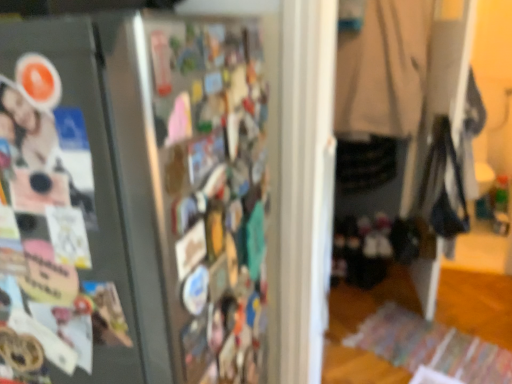
Describe the element at coordinates (45, 154) in the screenshot. I see `matte photo at left` at that location.

In order to face satin black fridge at left, should I rotate leftwards or rightwards?

You should look left and rotate roughly 15.573 degrees.

Measure the distance between satin black fridge at left and camera.

A distance of 17.91 inches exists between satin black fridge at left and camera.

Image resolution: width=512 pixels, height=384 pixels. Identify the location of matte photo at left. (45, 154).

Considering the sizes of satin black fridge at left and matte photo at left in the image, is satin black fridge at left bigger or smaller than matte photo at left?

Clearly, satin black fridge at left is larger in size than matte photo at left.

The image size is (512, 384). Identify the location of person to the left of satin black fridge at left. (45, 154).

Could you tell me if satin black fridge at left is turned towards matte photo at left?

No, satin black fridge at left is not aimed at matte photo at left.

From the image's perspective, does satin black fridge at left appear higher than matte photo at left?

Incorrect, from the image's perspective, satin black fridge at left is lower than matte photo at left.

From a real-world perspective, is satin black fridge at left physically located above or below beige fabric coat at center?

satin black fridge at left is below beige fabric coat at center.

Between satin black fridge at left and beige fabric coat at center, which one appears on the left side from the viewer's perspective?

satin black fridge at left is more to the left.

From the image's perspective, would you say satin black fridge at left is shown under beige fabric coat at center?

Yes, from the image's perspective, satin black fridge at left is below beige fabric coat at center.

Is satin black fridge at left shorter than beige fabric coat at center?

No.

Does beige fabric coat at center appear on the right side of satin black fridge at left?

Yes.

From a real-world perspective, is beige fabric coat at center under satin black fridge at left?

No, from a real-world perspective, beige fabric coat at center is not under satin black fridge at left.

What's the angular difference between beige fabric coat at center and satin black fridge at left's facing directions?

The angle between the facing direction of beige fabric coat at center and the facing direction of satin black fridge at left is 90.8 degrees.

Can you confirm if beige fabric coat at center is bigger than satin black fridge at left?

Incorrect, beige fabric coat at center is not larger than satin black fridge at left.

Measure the distance from beige fabric coat at center to matte photo at left.

beige fabric coat at center and matte photo at left are 7.00 feet apart from each other.

Who is taller, beige fabric coat at center or matte photo at left?

beige fabric coat at center is taller.

Does beige fabric coat at center touch matte photo at left?

beige fabric coat at center and matte photo at left are clearly separated.

In terms of width, does beige fabric coat at center look wider or thinner when compared to matte photo at left?

beige fabric coat at center is wider than matte photo at left.

Is matte photo at left oriented away from satin black fridge at left?

Yes.

Is point (16, 186) more distant than point (81, 51)?

Yes, it is.

Which object is more forward, matte photo at left or satin black fridge at left?

satin black fridge at left is more forward.

From a real-world perspective, which object rests below the other?

beige fabric coat at center, from a real-world perspective.

Considering the sizes of matte photo at left and beige fabric coat at center in the image, is matte photo at left taller or shorter than beige fabric coat at center?

Clearly, matte photo at left is shorter compared to beige fabric coat at center.

Is matte photo at left in front of or behind beige fabric coat at center in the image?

Clearly, matte photo at left is in front of beige fabric coat at center.

Locate an element on the screen. Image resolution: width=512 pixels, height=384 pixels. refrigerator in front of the matte photo at left is located at coordinates (166, 195).

You are a GUI agent. You are given a task and a screenshot of the screen. Output one action in this format:
    pyautogui.click(x=<x>, y=<y>)
    Task: Click on the clothing behind the satin black fridge at left
    
    Given the screenshot: What is the action you would take?
    pyautogui.click(x=384, y=69)

Based on their spatial positions, is matte photo at left or beige fabric coat at center closer to satin black fridge at left?

matte photo at left.

Considering their positions, is satin black fridge at left positioned further to matte photo at left than beige fabric coat at center?

beige fabric coat at center is positioned further to the anchor matte photo at left.

Looking at the image, which one is located closer to matte photo at left, beige fabric coat at center or satin black fridge at left?

The object closer to matte photo at left is satin black fridge at left.

Based on their spatial positions, is satin black fridge at left or matte photo at left further from beige fabric coat at center?

matte photo at left is further to beige fabric coat at center.

Looking at the image, which one is located further to beige fabric coat at center, matte photo at left or satin black fridge at left?

matte photo at left is positioned further to the anchor beige fabric coat at center.

Which object lies further to the anchor point satin black fridge at left, beige fabric coat at center or matte photo at left?

beige fabric coat at center lies further to satin black fridge at left than the other object.

This screenshot has height=384, width=512. In order to click on person located between satin black fridge at left and beige fabric coat at center in the depth direction in this screenshot , I will do `click(45, 154)`.